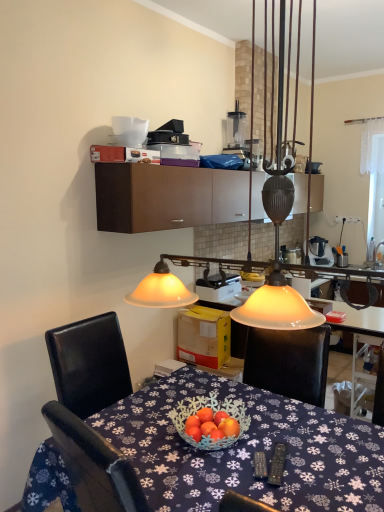
Question: Which direction should I rotate to look at white plastic blender at upper center, the 1th appliance viewed from the top, — up or down?

Choices:
 (A) down
 (B) up

Answer: (B)

Question: Is matte glass lampshade at upper center outside white plastic blender at upper center, the 1th appliance viewed from the top?

Choices:
 (A) no
 (B) yes

Answer: (B)

Question: Is white plastic blender at upper center, the 1th appliance viewed from the top, at the back of matte glass lampshade at upper center?

Choices:
 (A) yes
 (B) no

Answer: (B)

Question: Is matte glass lampshade at upper center further to the viewer compared to white plastic blender at upper center, which appears as the second appliance when viewed from the front?

Choices:
 (A) no
 (B) yes

Answer: (A)

Question: Would you consider matte glass lampshade at upper center to be distant from white plastic blender at upper center, positioned as the 2th appliance in bottom-to-top order?

Choices:
 (A) yes
 (B) no

Answer: (A)

Question: From a real-world perspective, is matte glass lampshade at upper center positioned under white plastic blender at upper center, which appears as the second appliance when viewed from the front, based on gravity?

Choices:
 (A) yes
 (B) no

Answer: (B)

Question: Is the depth of matte glass lampshade at upper center less than that of white plastic blender at upper center, which appears as the second appliance when viewed from the front?

Choices:
 (A) yes
 (B) no

Answer: (A)

Question: Is brown matte cabinet at upper center in front of white plastic toaster at center, the first appliance when ordered from left to right?

Choices:
 (A) yes
 (B) no

Answer: (A)

Question: From a real-world perspective, is brown matte cabinet at upper center physically above white plastic toaster at center, which appears as the first appliance when ordered from the bottom?

Choices:
 (A) yes
 (B) no

Answer: (A)

Question: Can you confirm if brown matte cabinet at upper center is bigger than white plastic toaster at center, placed as the 2th appliance when sorted from back to front?

Choices:
 (A) yes
 (B) no

Answer: (A)

Question: Is white plastic toaster at center, the first appliance when ordered from left to right, at the back of brown matte cabinet at upper center?

Choices:
 (A) no
 (B) yes

Answer: (A)

Question: Does brown matte cabinet at upper center appear on the left side of white plastic toaster at center, placed as the 2th appliance when sorted from back to front?

Choices:
 (A) no
 (B) yes

Answer: (A)

Question: Does brown matte cabinet at upper center have a lesser height compared to white plastic toaster at center, which appears as the first appliance when ordered from the bottom?

Choices:
 (A) no
 (B) yes

Answer: (A)

Question: Is white plastic blender at upper center, which appears as the second appliance when viewed from the front, aimed at blue fabric tablecloth at center?

Choices:
 (A) no
 (B) yes

Answer: (A)